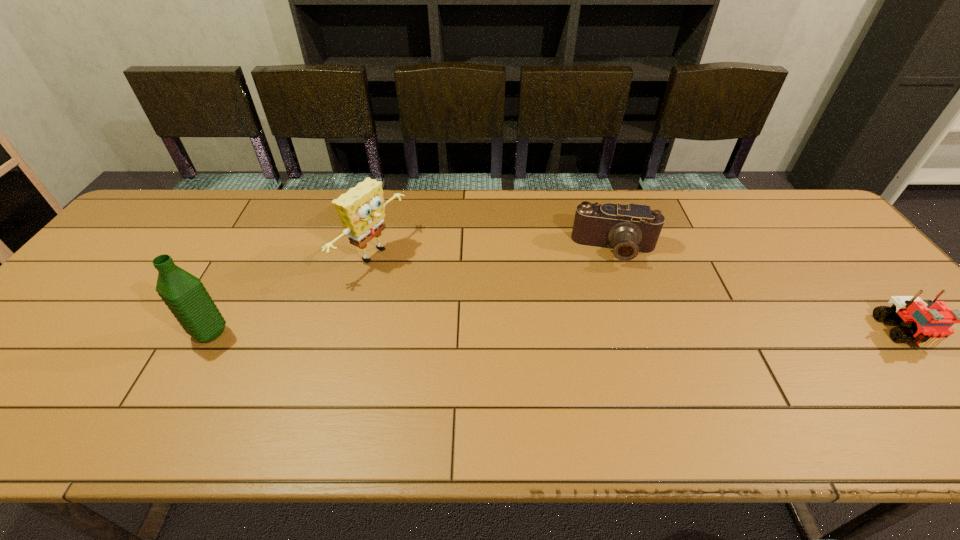
The width and height of the screenshot is (960, 540). What are the coordinates of `free spot on the desktop that is between the leftmost object and the rightmost object and is positioned on the front-facing side of the second object from right to left` in the screenshot? It's located at (616, 333).

The height and width of the screenshot is (540, 960). Identify the location of free space on the desktop that is between the leftmost object and the rightmost object and is positioned on the face of the second object from left to right. (535, 333).